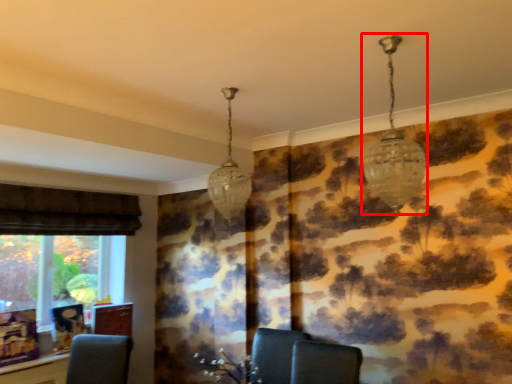
Question: From the image, what is the correct spatial relationship of lamp (annotated by the red box) in relation to lamp?

Choices:
 (A) left
 (B) right

Answer: (B)